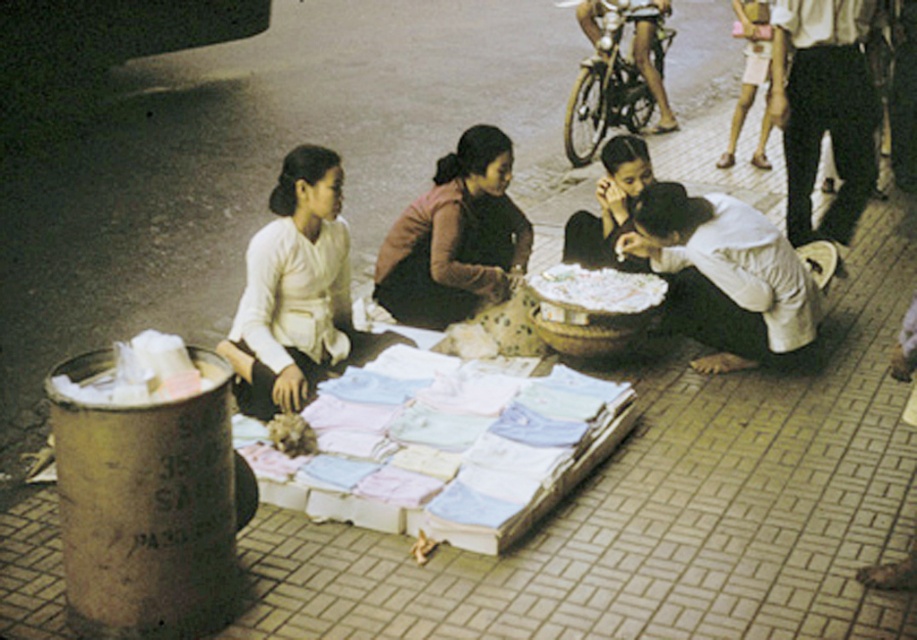
Is pale blue cotton shirts at center thinner than white matte fabric at lower center?

Incorrect, pale blue cotton shirts at center's width is not less than white matte fabric at lower center's.

Between point (417, 406) and point (704, 337), which one is positioned behind?

The point (704, 337) is more distant.

Identify the location of pale blue cotton shirts at center. (447, 452).

In the scene shown: Is pale blue cotton shirts at center thinner than matte white blouse at left?

In fact, pale blue cotton shirts at center might be wider than matte white blouse at left.

Is pale blue cotton shirts at center positioned behind matte white blouse at left?

No, it is not.

Is point (400, 525) closer to camera compared to point (271, 282)?

That is True.

Where is `pale blue cotton shirts at center`? Image resolution: width=917 pixels, height=640 pixels. pale blue cotton shirts at center is located at coordinates (447, 452).

How far apart are matte white blouse at left and white matte fabric at lower center?

matte white blouse at left and white matte fabric at lower center are 6.49 feet apart from each other.

Can you confirm if matte white blouse at left is positioned below white matte fabric at lower center?

Actually, matte white blouse at left is above white matte fabric at lower center.

What do you see at coordinates (297, 292) in the screenshot? I see `matte white blouse at left` at bounding box center [297, 292].

This screenshot has height=640, width=917. Identify the location of matte white blouse at left. (297, 292).